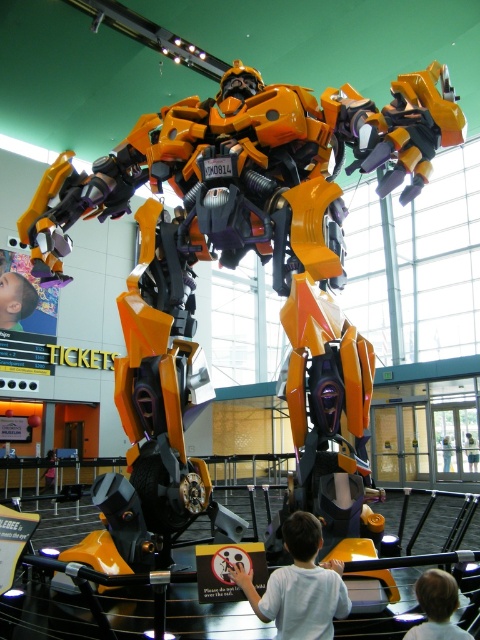
Who is lower down, white matte shirt at lower center or smooth skin child at lower right?

smooth skin child at lower right is below.

Can you confirm if white matte shirt at lower center is smaller than smooth skin child at lower right?

No.

Where is `white matte shirt at lower center`? The image size is (480, 640). white matte shirt at lower center is located at coordinates (300, 586).

Image resolution: width=480 pixels, height=640 pixels. Find the location of `white matte shirt at lower center`. white matte shirt at lower center is located at coordinates (300, 586).